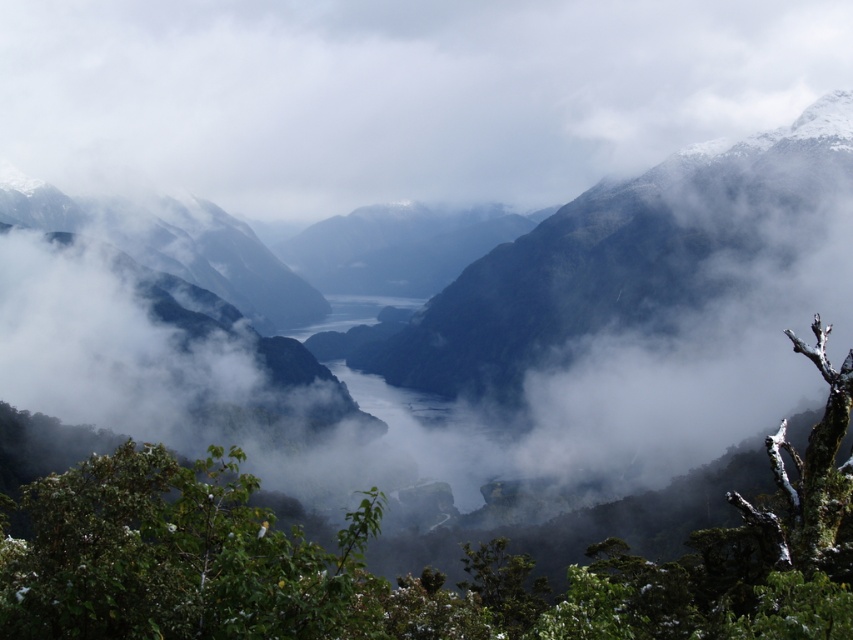
Question: Does white fluffy cloud at center have a lesser width compared to green leafy tree at center?

Choices:
 (A) no
 (B) yes

Answer: (A)

Question: Is white fluffy cloud at center behind green leafy tree at center?

Choices:
 (A) yes
 (B) no

Answer: (A)

Question: Is white fluffy cloud at center below green leafy tree at center?

Choices:
 (A) no
 (B) yes

Answer: (A)

Question: Which of the following is the closest to the observer?

Choices:
 (A) (102, 460)
 (B) (666, 28)

Answer: (A)